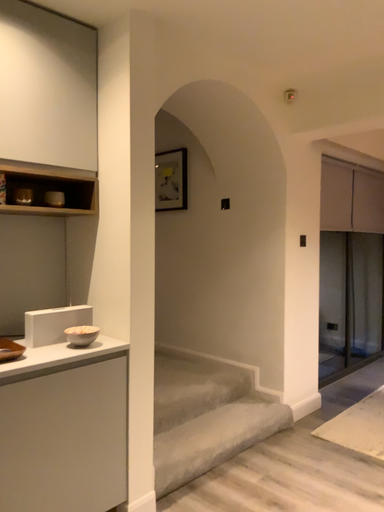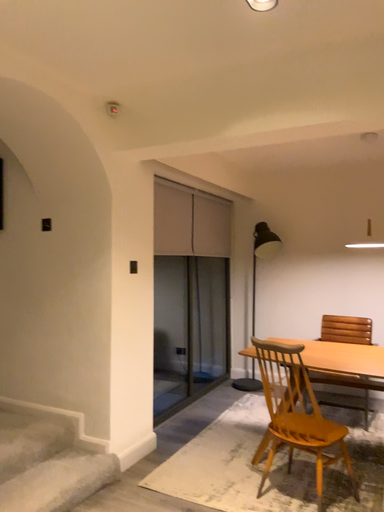
Question: Which way did the camera rotate in the video?

Choices:
 (A) rotated left
 (B) rotated right

Answer: (B)